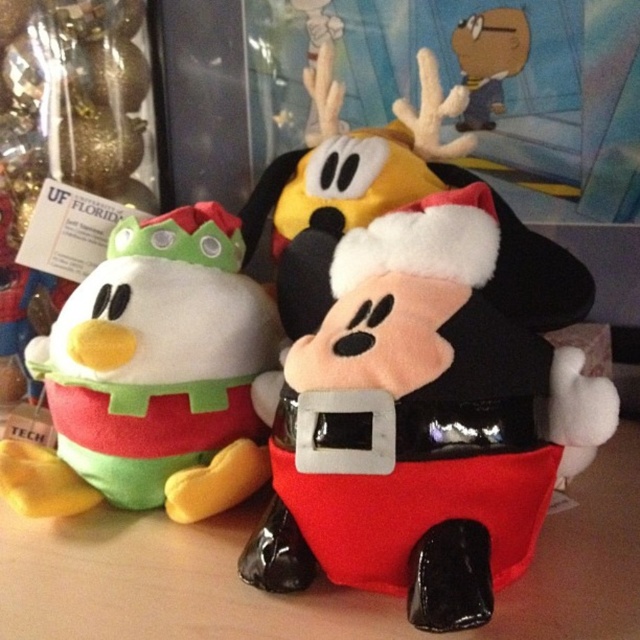
Who is more forward, (291,524) or (90,451)?

Point (291,524) is in front.

How much distance is there between velvet santa mickey at center and velvety green plush duckling at left?

They are 8.52 inches apart.

Does point (320, 387) lie in front of point (150, 410)?

Yes, it is.

You are a GUI agent. You are given a task and a screenshot of the screen. Output one action in this format:
    pyautogui.click(x=<x>, y=<y>)
    Task: Click on the velvet santa mickey at center
    
    Given the screenshot: What is the action you would take?
    (x=419, y=348)

Can you confirm if velvet santa mickey at center is smaller than smooth brown hat at upper center?

No.

Does point (464, 193) lie in front of point (524, 35)?

Yes, point (464, 193) is in front of point (524, 35).

At what (x,y) coordinates should I click in order to perform the action: click on velvet santa mickey at center. Please return your answer as a coordinate pair (x, y). The image size is (640, 640). Looking at the image, I should click on (419, 348).

Can you confirm if velvety green plush duckling at left is shorter than smooth brown hat at upper center?

No, velvety green plush duckling at left is not shorter than smooth brown hat at upper center.

Looking at this image, is velvety green plush duckling at left below smooth brown hat at upper center?

Yes.

This screenshot has height=640, width=640. I want to click on velvety green plush duckling at left, so click(x=152, y=376).